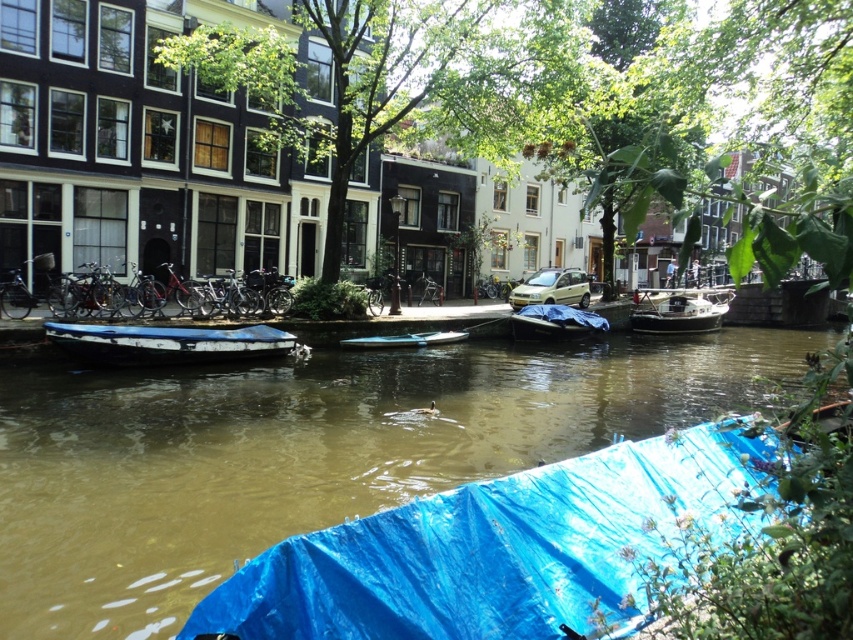
You are a photographer planning to capture a reflection shot of the canal. You notice the blue tarp at center and the shiny silver boat at center. Which object might block the reflection of the other when positioned in the water?

The blue tarp at center is taller than the shiny silver boat at center, so it might block the reflection of the shiny silver boat at center.